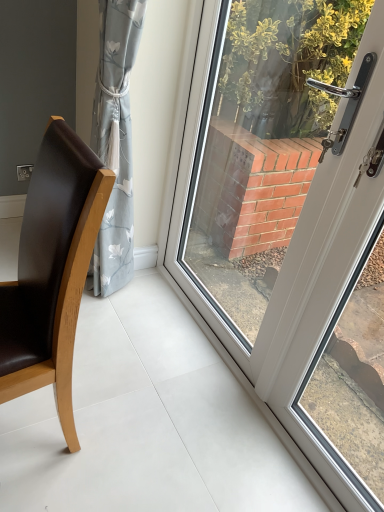
What is the approximate width of white glossy door at center?

The width of white glossy door at center is 2.98 inches.

This screenshot has height=512, width=384. Describe the element at coordinates (293, 220) in the screenshot. I see `white glossy door at center` at that location.

In order to face white glossy door at center, should I rotate leftwards or rightwards?

Turn right approximately 11.544 degrees to face it.

Where is `white glossy door at center`? This screenshot has width=384, height=512. white glossy door at center is located at coordinates (293, 220).

Describe the element at coordinates (52, 270) in the screenshot. The height and width of the screenshot is (512, 384). I see `brown leather chair at left` at that location.

Identify the location of brown leather chair at left. pyautogui.click(x=52, y=270).

Where is `white glossy door at center`? white glossy door at center is located at coordinates (293, 220).

From the picture: Considering the relative positions of brown leather chair at left and white glossy door at center in the image provided, is brown leather chair at left to the left of white glossy door at center from the viewer's perspective?

Indeed, brown leather chair at left is positioned on the left side of white glossy door at center.

Considering their positions, is brown leather chair at left located in front of or behind white glossy door at center?

Clearly, brown leather chair at left is behind white glossy door at center.

Which point is more distant from viewer, (2, 377) or (347, 71)?

The point (347, 71) is more distant.

From the image's perspective, is brown leather chair at left located above white glossy door at center?

No, from the image's perspective, brown leather chair at left is not on top of white glossy door at center.

From a real-world perspective, which is physically above, brown leather chair at left or white glossy door at center?

white glossy door at center, from a real-world perspective.

Is brown leather chair at left thinner than white glossy door at center?

No, brown leather chair at left is not thinner than white glossy door at center.

Between brown leather chair at left and white glossy door at center, which one has more height?

white glossy door at center is taller.

Is brown leather chair at left bigger or smaller than white glossy door at center?

brown leather chair at left is smaller than white glossy door at center.

Would you say white glossy door at center is part of brown leather chair at left's contents?

Definitely not — white glossy door at center is not inside brown leather chair at left.

Would you say brown leather chair at left is a long distance from white glossy door at center?

No, brown leather chair at left is not far from white glossy door at center.

Is brown leather chair at left oriented towards white glossy door at center?

No, brown leather chair at left is not turned towards white glossy door at center.

How many degrees apart are the facing directions of brown leather chair at left and white glossy door at center?

The angle between the facing direction of brown leather chair at left and the facing direction of white glossy door at center is 2.19 degrees.

This screenshot has height=512, width=384. In order to click on chair located on the left of white glossy door at center in this screenshot , I will do `click(52, 270)`.

Can you confirm if white glossy door at center is positioned to the right of brown leather chair at left?

Yes.

Considering the positions of objects white glossy door at center and brown leather chair at left in the image provided, who is in front, white glossy door at center or brown leather chair at left?

white glossy door at center.

Considering the points (247, 308) and (23, 361), which point is behind, point (247, 308) or point (23, 361)?

Point (247, 308)

Consider the image. From the image's perspective, is white glossy door at center under brown leather chair at left?

No, from the image's perspective, white glossy door at center is not below brown leather chair at left.

From a real-world perspective, is white glossy door at center on top of brown leather chair at left?

Yes, from a real-world perspective, white glossy door at center is over brown leather chair at left

Which of these two, white glossy door at center or brown leather chair at left, is wider?

With larger width is brown leather chair at left.

Can you confirm if white glossy door at center is shorter than brown leather chair at left?

No.

Who is smaller, white glossy door at center or brown leather chair at left?

Smaller between the two is brown leather chair at left.

Would you say white glossy door at center is inside or outside brown leather chair at left?

white glossy door at center cannot be found inside brown leather chair at left.

Is white glossy door at center not close to brown leather chair at left?

white glossy door at center is near brown leather chair at left, not far away.

Is white glossy door at center turned away from brown leather chair at left?

Yes, white glossy door at center is positioned with its back facing brown leather chair at left.

How different are the orientations of white glossy door at center and brown leather chair at left in degrees?

They differ by 2.19 degrees in their facing directions.

How far apart are white glossy door at center and brown leather chair at left?

A distance of 37.64 inches exists between white glossy door at center and brown leather chair at left.

The image size is (384, 512). There is a brown leather chair at left. Identify the location of door above it (from a real-world perspective). (293, 220).

The image size is (384, 512). In order to click on door that appears in front of the brown leather chair at left in this screenshot , I will do coord(293,220).

Locate an element on the screen. chair below the white glossy door at center (from a real-world perspective) is located at coordinates (52, 270).